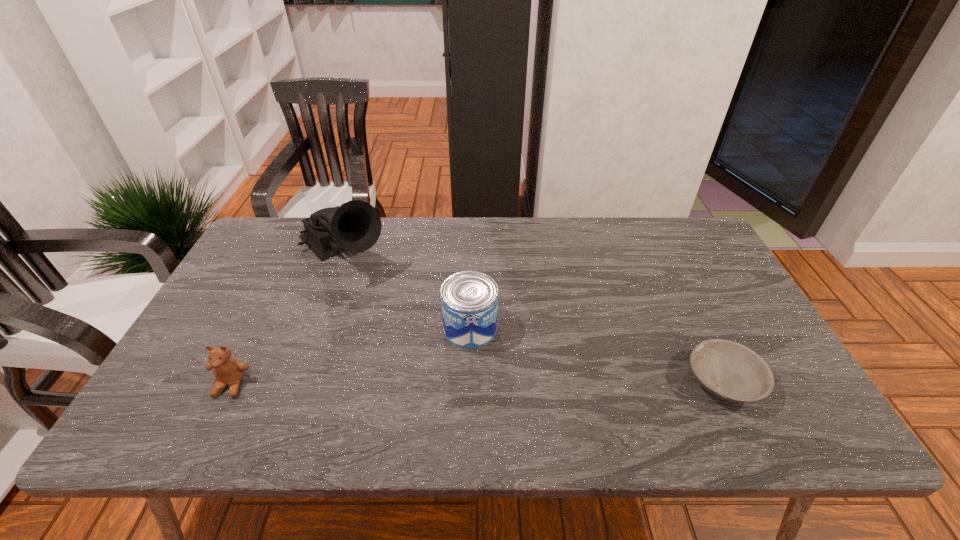
Identify the location of vacant region located from the horn of the phonograph_record. Image resolution: width=960 pixels, height=540 pixels. (425, 339).

Where is `free space located 0.250m on the front label of the second tallest object`? free space located 0.250m on the front label of the second tallest object is located at coordinates (571, 403).

At what (x,y) coordinates should I click in order to perform the action: click on free space located 0.080m on the front label of the second tallest object. Please return your answer as a coordinate pair (x, y). The width and height of the screenshot is (960, 540). Looking at the image, I should click on pyautogui.click(x=514, y=361).

This screenshot has width=960, height=540. What are the coordinates of `free space located 0.190m on the front label of the second tallest object` in the screenshot? It's located at (550, 387).

The image size is (960, 540). Identify the location of object present at the far edge. (355, 226).

At what (x,y) coordinates should I click in order to perform the action: click on teddy bear that is at the near edge. Please return your answer as a coordinate pair (x, y). Looking at the image, I should click on (228, 371).

Where is `bowl positioned at the near edge`? The image size is (960, 540). bowl positioned at the near edge is located at coordinates (728, 370).

Locate an element on the screen. The height and width of the screenshot is (540, 960). teddy bear present at the left edge is located at coordinates (228, 371).

Find the location of a particular element. The image size is (960, 540). phonograph_record located at the left edge is located at coordinates [x=355, y=226].

The image size is (960, 540). What are the coordinates of `object present at the right edge` in the screenshot? It's located at [x=728, y=370].